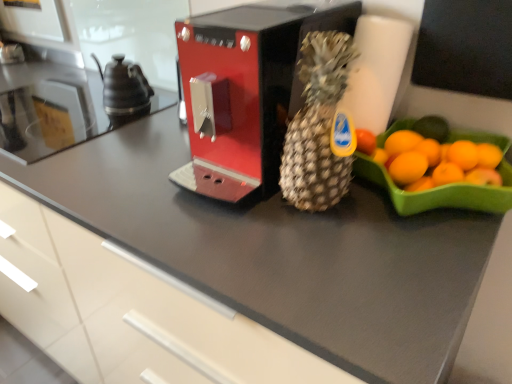
At what (x,y) coordinates should I click in order to perform the action: click on vacant space to the left of metallic red coffee machine at center. Please return your answer as a coordinate pair (x, y). Looking at the image, I should click on (125, 161).